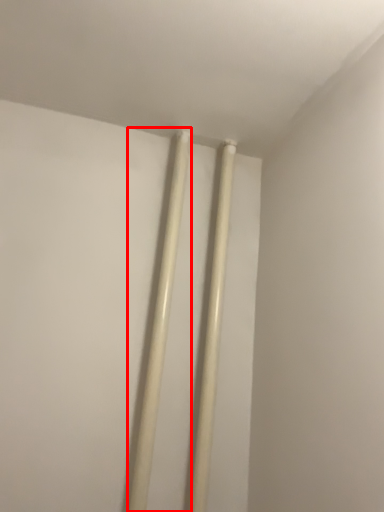
Question: Observing the image, what is the correct spatial positioning of chopsticks (annotated by the red box) in reference to beam?

Choices:
 (A) left
 (B) right

Answer: (A)